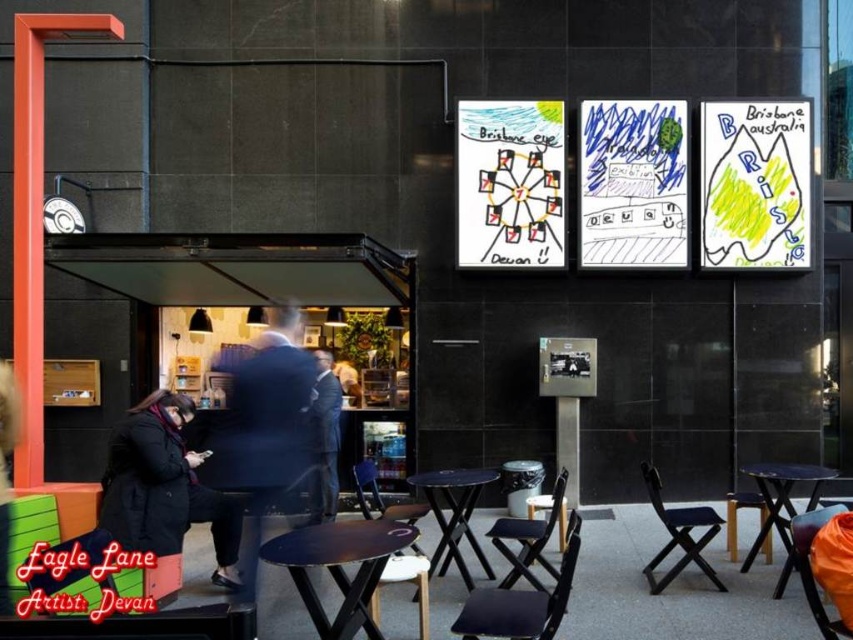
Who is shorter, black fabric chair at center or wooden stool at lower center?

With less height is black fabric chair at center.

Which is below, black fabric chair at center or wooden stool at lower center?

Positioned lower is wooden stool at lower center.

Which is behind, point (564, 564) or point (392, 560)?

The point (392, 560) is more distant.

Where is `black fabric chair at center`? black fabric chair at center is located at coordinates 521,602.

Is black fabric chair at center to the left of black plastic table at lower right from the viewer's perspective?

Correct, you'll find black fabric chair at center to the left of black plastic table at lower right.

Which is behind, point (546, 612) or point (776, 461)?

Positioned behind is point (776, 461).

Locate an element on the screen. black fabric chair at center is located at coordinates (521, 602).

Between black suit at center and matte black table at center, which one has more height?

Standing taller between the two is black suit at center.

Is black suit at center to the left of matte black table at center from the viewer's perspective?

Yes, black suit at center is to the left of matte black table at center.

Does point (274, 369) come closer to viewer compared to point (351, 589)?

That is False.

Find the location of a particular element. black suit at center is located at coordinates (265, 428).